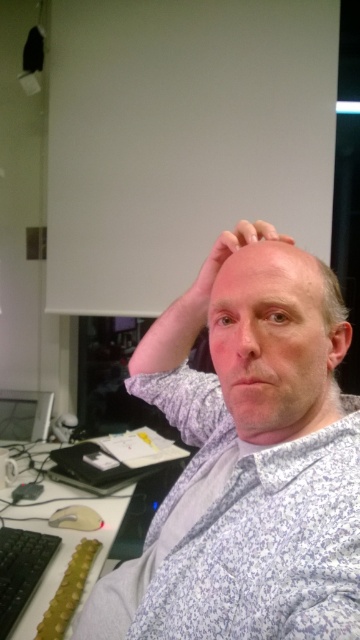
You are organizing a desk and need to place a new keyboard. The black plastic computer desk at lower left and the matte black monitor at lower left are both in your way. Which one do you need to move to make space for the keyboard?

The black plastic computer desk at lower left is taller than the matte black monitor at lower left, so you should move the matte black monitor at lower left since it is shorter and likely closer to the desk surface where the keyboard would be placed.

You are a delivery person who needs to place a package on the desk in the image. The package is 80 centimeters wide. Can you fit it on the black plastic computer desk at lower left without moving any items?

The black plastic computer desk at lower left is 81.71 centimeters from camera. Since the package is 80 centimeters wide, it should fit on the desk as long as there is enough space along its length. However, the description only provides the distance from the camera, not the desk dimensions, so we cannot confirm the desk size. Therefore, it might not be possible to determine without more information about the desk dimensions.